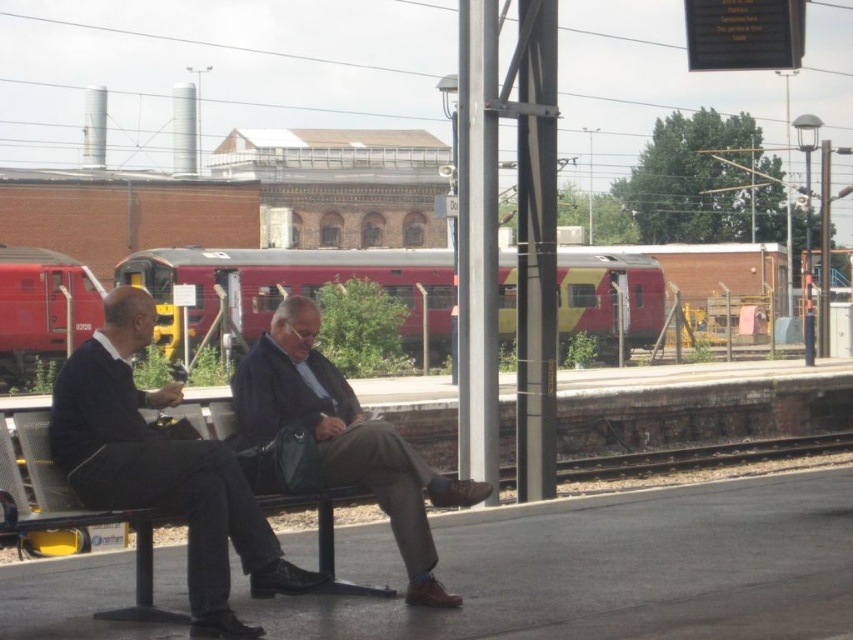
Question: Which of the following is the farthest from the observer?

Choices:
 (A) dark blue suit at center
 (B) red/yellow painted train at center

Answer: (B)

Question: Does dark blue suit at center appear under dark brown leather shoes at center?

Choices:
 (A) no
 (B) yes

Answer: (B)

Question: Which of these objects is positioned closest to the red matte train at left?

Choices:
 (A) red/yellow painted train at center
 (B) dark brown leather shoes at center

Answer: (A)

Question: Estimate the real-world distances between objects in this image. Which object is closer to the dark brown leather shoes at center?

Choices:
 (A) red/yellow painted train at center
 (B) dark blue suit at center
 (C) red matte train at left

Answer: (B)

Question: Is dark brown leather shoes at center positioned behind red matte train at left?

Choices:
 (A) no
 (B) yes

Answer: (A)

Question: Observing the image, what is the correct spatial positioning of red/yellow painted train at center in reference to red matte train at left?

Choices:
 (A) below
 (B) above

Answer: (B)